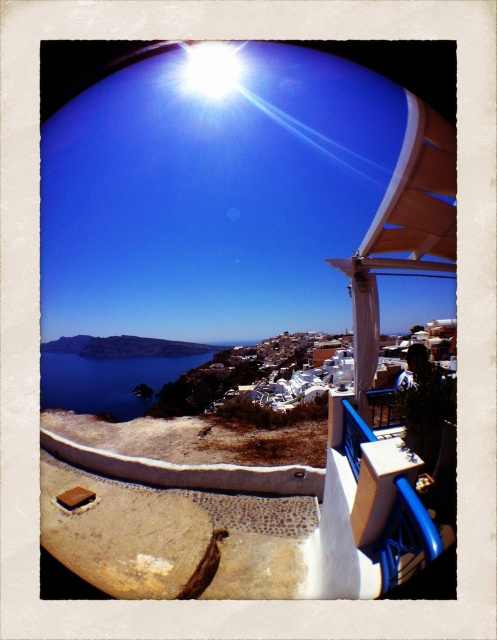
What are the coordinates of `white matte terrace at upper center` in the screenshot? It's located at (210, 292).

Which is more to the right, white matte terrace at upper center or blue water at lower left?

white matte terrace at upper center

What do you see at coordinates (210, 292) in the screenshot?
I see `white matte terrace at upper center` at bounding box center [210, 292].

I want to click on white matte terrace at upper center, so click(210, 292).